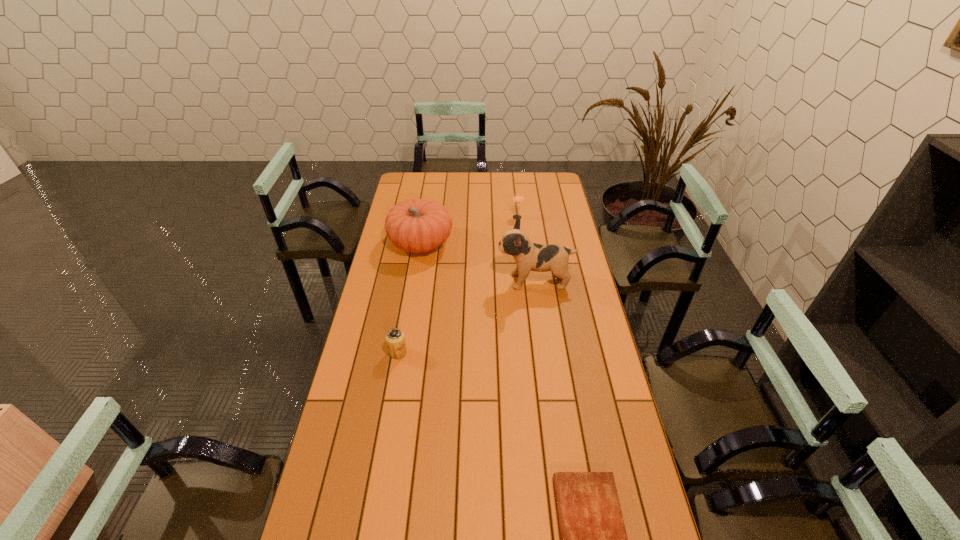
Where is `vacant region between the second nearest object and the fourth nearest object`? Image resolution: width=960 pixels, height=540 pixels. vacant region between the second nearest object and the fourth nearest object is located at coordinates (410, 298).

The image size is (960, 540). I want to click on vacant space that is in between the fourth farthest object and the fourth nearest object, so click(x=410, y=298).

Identify the location of object that is the third closest to the fourth nearest object. (395, 339).

Locate which object ranks in proximity to the tallest object. Please provide its 2D coordinates. Your answer should be formatted as a tuple, i.e. [(x, y)], where the tuple contains the x and y coordinates of a point satisfying the conditions above.

[(417, 226)]

You are a GUI agent. You are given a task and a screenshot of the screen. Output one action in this format:
    pyautogui.click(x=<x>, y=<y>)
    Task: Click on the vacant space that satisfies the following two spatial constraints: 1. at the face of the third nearest object; 2. on the front side of the fourth farthest object
    
    Given the screenshot: What is the action you would take?
    pyautogui.click(x=544, y=352)